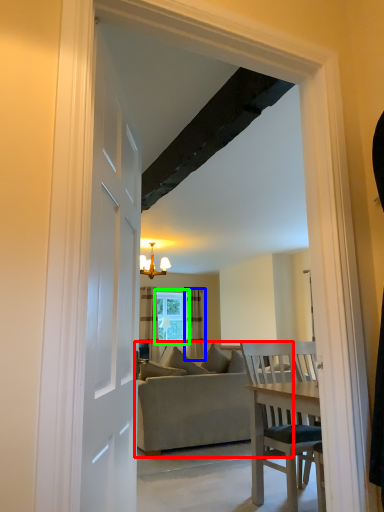
Question: Based on their relative distances, which object is farther from studio couch (highlighted by a red box)? Choose from curtain (highlighted by a blue box) and window (highlighted by a green box).

Choices:
 (A) curtain
 (B) window

Answer: (B)